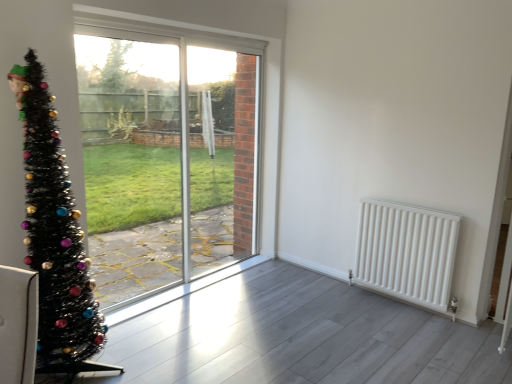
Question: Is white matte radiator at right inside or outside of clear glass screen door at center?

Choices:
 (A) outside
 (B) inside

Answer: (A)

Question: In terms of height, does white matte radiator at right look taller or shorter compared to clear glass screen door at center?

Choices:
 (A) tall
 (B) short

Answer: (B)

Question: Considering the real-world distances, which object is closest to the white matte radiator at right?

Choices:
 (A) black tinsel christmas tree at left
 (B) clear glass screen door at center
 (C) transparent glass window at center

Answer: (B)

Question: Which object is the farthest from the clear glass screen door at center?

Choices:
 (A) black tinsel christmas tree at left
 (B) transparent glass window at center
 (C) white matte radiator at right

Answer: (A)